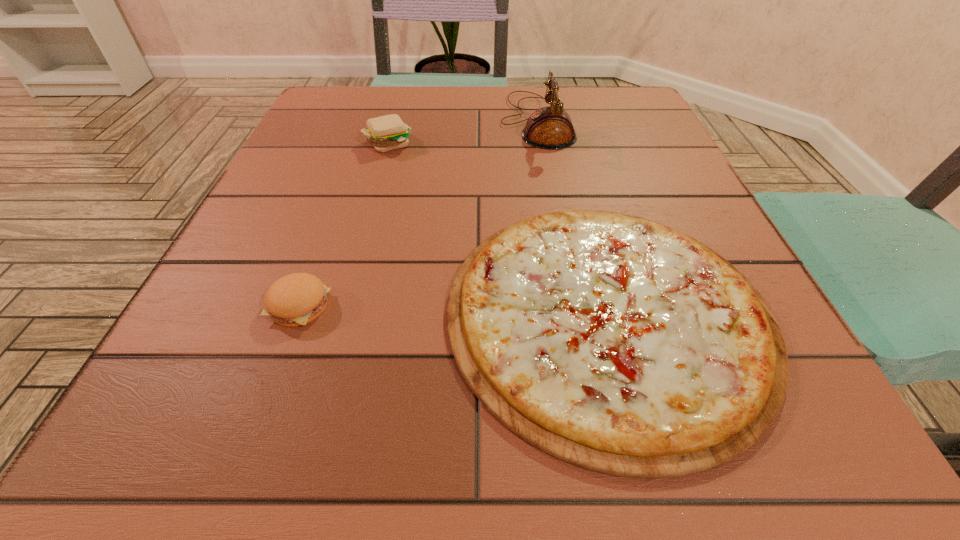
Identify the location of the tallest object. The image size is (960, 540). (550, 127).

This screenshot has width=960, height=540. Identify the location of the taller patty. (385, 133).

Locate an element on the screen. The image size is (960, 540). the farther patty is located at coordinates (385, 133).

This screenshot has width=960, height=540. Identify the location of the second shortest object. (x=296, y=299).

Find the location of a particular element. The width and height of the screenshot is (960, 540). the shorter patty is located at coordinates (296, 299).

Where is `the shortest object`? the shortest object is located at coordinates (617, 344).

You are a GUI agent. You are given a task and a screenshot of the screen. Output one action in this format:
    pyautogui.click(x=<x>, y=<y>)
    Task: Click on the free space located 0.320m on the rotary dial of the telephone
    
    Given the screenshot: What is the action you would take?
    pyautogui.click(x=353, y=121)

What are the coordinates of `vacant space situated 0.100m on the rotary dial of the telephone` in the screenshot? It's located at (455, 121).

Where is `free space located 0.260m on the rotary dial of the telephone`? free space located 0.260m on the rotary dial of the telephone is located at coordinates (381, 121).

This screenshot has height=540, width=960. Identify the location of free space located 0.220m on the back of the taller patty. (404, 87).